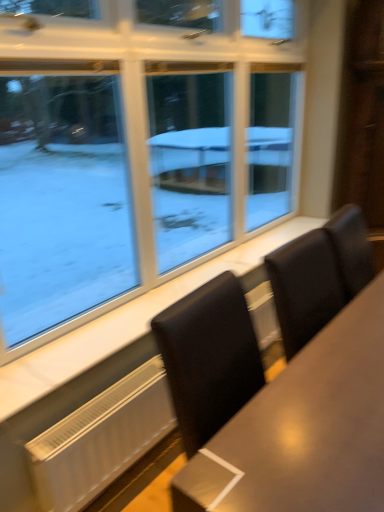
Question: Does white matte radiator at lower left appear on the left side of clear glass window at upper left?

Choices:
 (A) yes
 (B) no

Answer: (A)

Question: Does white matte radiator at lower left have a lesser width compared to clear glass window at upper left?

Choices:
 (A) yes
 (B) no

Answer: (B)

Question: Does white matte radiator at lower left have a greater width compared to clear glass window at upper left?

Choices:
 (A) no
 (B) yes

Answer: (B)

Question: Considering the relative positions of white matte radiator at lower left and clear glass window at upper left in the image provided, is white matte radiator at lower left to the right of clear glass window at upper left from the viewer's perspective?

Choices:
 (A) yes
 (B) no

Answer: (B)

Question: Is the depth of white matte radiator at lower left greater than that of clear glass window at upper left?

Choices:
 (A) yes
 (B) no

Answer: (A)

Question: Would you say white matte radiator at lower left is outside clear glass window at upper left?

Choices:
 (A) no
 (B) yes

Answer: (B)

Question: Is clear glass window at upper left bigger than white matte radiator at lower left?

Choices:
 (A) no
 (B) yes

Answer: (B)

Question: Is clear glass window at upper left oriented away from white matte radiator at lower left?

Choices:
 (A) yes
 (B) no

Answer: (B)

Question: Does clear glass window at upper left have a lesser width compared to white matte radiator at lower left?

Choices:
 (A) no
 (B) yes

Answer: (B)

Question: Can you see clear glass window at upper left touching white matte radiator at lower left?

Choices:
 (A) yes
 (B) no

Answer: (B)

Question: Can you confirm if clear glass window at upper left is smaller than white matte radiator at lower left?

Choices:
 (A) no
 (B) yes

Answer: (A)

Question: From the image's perspective, is clear glass window at upper left on top of white matte radiator at lower left?

Choices:
 (A) yes
 (B) no

Answer: (A)

Question: Considering the relative sizes of clear glass window at upper left and white marble window sill at lower center in the image provided, is clear glass window at upper left taller than white marble window sill at lower center?

Choices:
 (A) yes
 (B) no

Answer: (A)